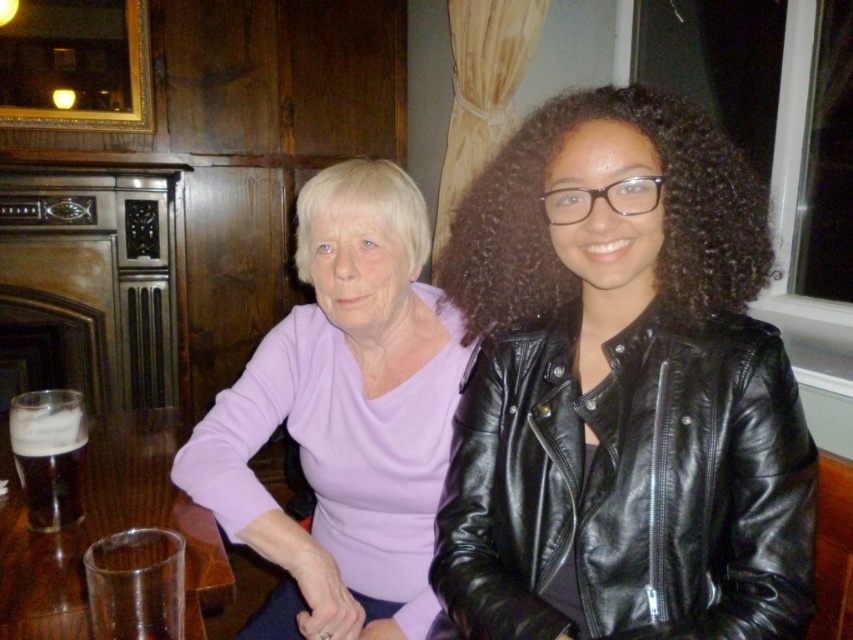
Question: Which point appears closest to the camera in this image?

Choices:
 (A) (76, 518)
 (B) (96, 492)

Answer: (A)

Question: Can you confirm if purple matte sweater at center is positioned to the right of clear glass at lower left?

Choices:
 (A) no
 (B) yes

Answer: (B)

Question: Is clear glass at lower left smaller than dark brown glass at lower left?

Choices:
 (A) no
 (B) yes

Answer: (B)

Question: Which object is the closest to the dark brown glass at lower left?

Choices:
 (A) clear glass at lower left
 (B) matte purple sweater at upper left

Answer: (A)

Question: Considering the relative positions of purple matte sweater at center and clear glass at lower left in the image provided, where is purple matte sweater at center located with respect to clear glass at lower left?

Choices:
 (A) above
 (B) below

Answer: (A)

Question: Which is farther from the transparent glass at lower left?

Choices:
 (A) dark brown glass at lower left
 (B) clear glass at lower left
 (C) purple matte sweater at center
 (D) matte purple sweater at upper left

Answer: (D)